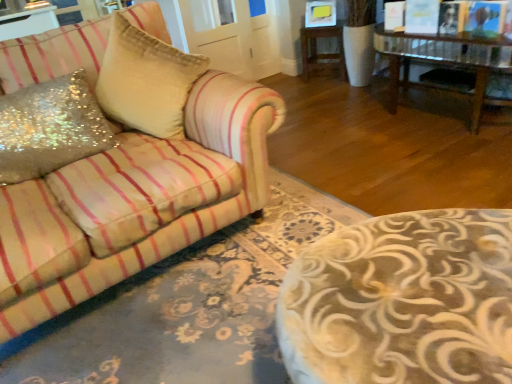
Question: Does wooden side table at center come behind glittery sequined pillow at left, which is the second throw pillow from right to left?

Choices:
 (A) no
 (B) yes

Answer: (B)

Question: From the image's perspective, is wooden side table at center located beneath glittery sequined pillow at left, which is the second throw pillow from right to left?

Choices:
 (A) yes
 (B) no

Answer: (B)

Question: Considering the relative sizes of wooden side table at center and glittery sequined pillow at left, which is the second throw pillow from right to left, in the image provided, is wooden side table at center thinner than glittery sequined pillow at left, which is the second throw pillow from right to left,?

Choices:
 (A) no
 (B) yes

Answer: (A)

Question: Considering the relative sizes of wooden side table at center and glittery sequined pillow at left, which is the second throw pillow from right to left, in the image provided, is wooden side table at center shorter than glittery sequined pillow at left, which is the second throw pillow from right to left,?

Choices:
 (A) yes
 (B) no

Answer: (B)

Question: From a real-world perspective, is wooden side table at center located beneath glittery sequined pillow at left, which is the first throw pillow in left-to-right order?

Choices:
 (A) no
 (B) yes

Answer: (B)

Question: Which is correct: wooden side table at center is inside glittery sequined pillow at left, which is the second throw pillow from right to left, or outside of it?

Choices:
 (A) outside
 (B) inside

Answer: (A)

Question: Looking at the image, does wooden side table at center seem bigger or smaller compared to glittery sequined pillow at left, which is the second throw pillow from right to left?

Choices:
 (A) small
 (B) big

Answer: (B)

Question: From the image's perspective, is wooden side table at center located above or below glittery sequined pillow at left, which is the first throw pillow in left-to-right order?

Choices:
 (A) below
 (B) above

Answer: (B)

Question: In the image, is wooden side table at center positioned in front of or behind glittery sequined pillow at left, which is the first throw pillow in left-to-right order?

Choices:
 (A) behind
 (B) front

Answer: (A)

Question: Considering the positions of glittery sequined pillow at left, which is the second throw pillow from right to left, and sequined fabric pillow at left, arranged as the second throw pillow when viewed from the left, in the image, is glittery sequined pillow at left, which is the second throw pillow from right to left, taller or shorter than sequined fabric pillow at left, arranged as the second throw pillow when viewed from the left,?

Choices:
 (A) tall
 (B) short

Answer: (B)

Question: Is point (64, 117) positioned closer to the camera than point (119, 89)?

Choices:
 (A) farther
 (B) closer

Answer: (B)

Question: Which is correct: glittery sequined pillow at left, which is the second throw pillow from right to left, is inside sequined fabric pillow at left, arranged as the second throw pillow when viewed from the left, or outside of it?

Choices:
 (A) outside
 (B) inside

Answer: (A)

Question: Relative to sequined fabric pillow at left, arranged as the second throw pillow when viewed from the left, is glittery sequined pillow at left, which is the second throw pillow from right to left, in front or behind?

Choices:
 (A) front
 (B) behind

Answer: (A)

Question: Is sequined fabric pillow at left, arranged as the second throw pillow when viewed from the left, bigger or smaller than glittery sequined pillow at left, which is the first throw pillow in left-to-right order?

Choices:
 (A) small
 (B) big

Answer: (B)

Question: Is sequined fabric pillow at left, arranged as the second throw pillow when viewed from the left, wider or thinner than glittery sequined pillow at left, which is the second throw pillow from right to left?

Choices:
 (A) wide
 (B) thin

Answer: (A)